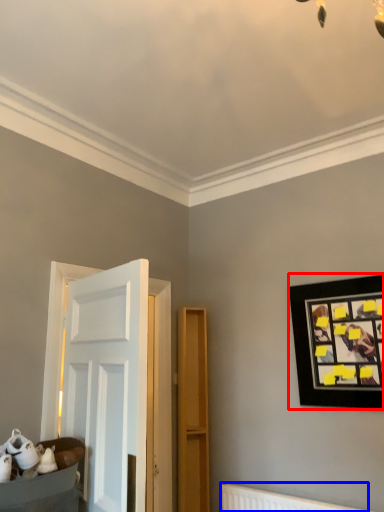
Question: Which object is closer to the camera taking this photo, picture frame (highlighted by a red box) or radiator (highlighted by a blue box)?

Choices:
 (A) picture frame
 (B) radiator

Answer: (B)